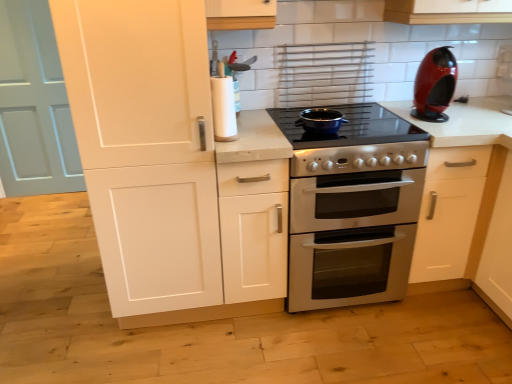
Where is `free space to the left of white matte cabinet at left`? Image resolution: width=512 pixels, height=384 pixels. free space to the left of white matte cabinet at left is located at coordinates (59, 309).